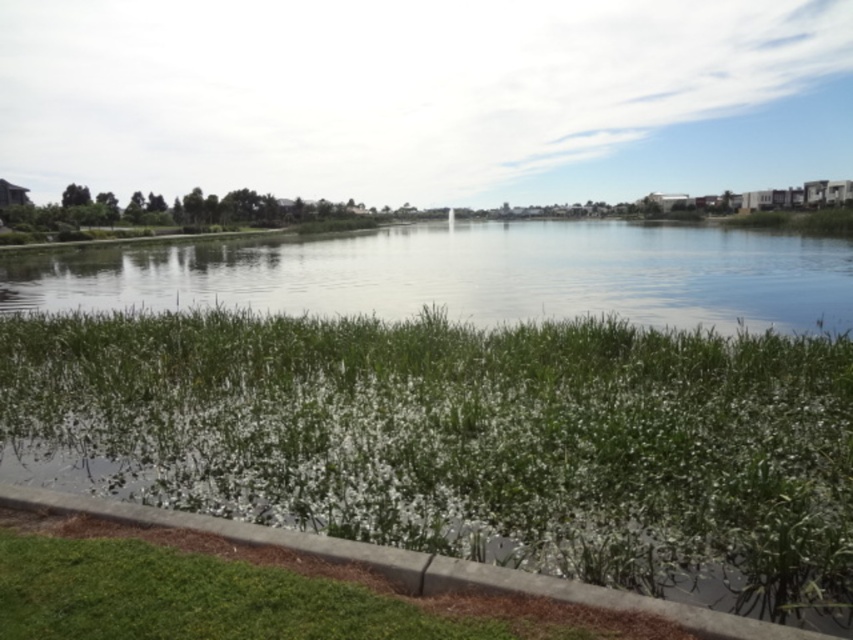
Question: Which point is farther from the camera taking this photo?

Choices:
 (A) (500, 317)
 (B) (624, 420)
 (C) (669, 602)

Answer: (A)

Question: Does green leafy grass at lower center have a smaller size compared to concrete at lower left?

Choices:
 (A) no
 (B) yes

Answer: (A)

Question: Does green leafy grass at lower center have a smaller size compared to concrete at lower left?

Choices:
 (A) no
 (B) yes

Answer: (A)

Question: Estimate the real-world distances between objects in this image. Which object is closer to the concrete at lower left?

Choices:
 (A) green grassy river at center
 (B) green leafy grass at lower center

Answer: (B)

Question: Is green leafy grass at lower center to the left of concrete at lower left from the viewer's perspective?

Choices:
 (A) yes
 (B) no

Answer: (A)

Question: Which point is closer to the camera?

Choices:
 (A) (345, 522)
 (B) (640, 260)

Answer: (A)